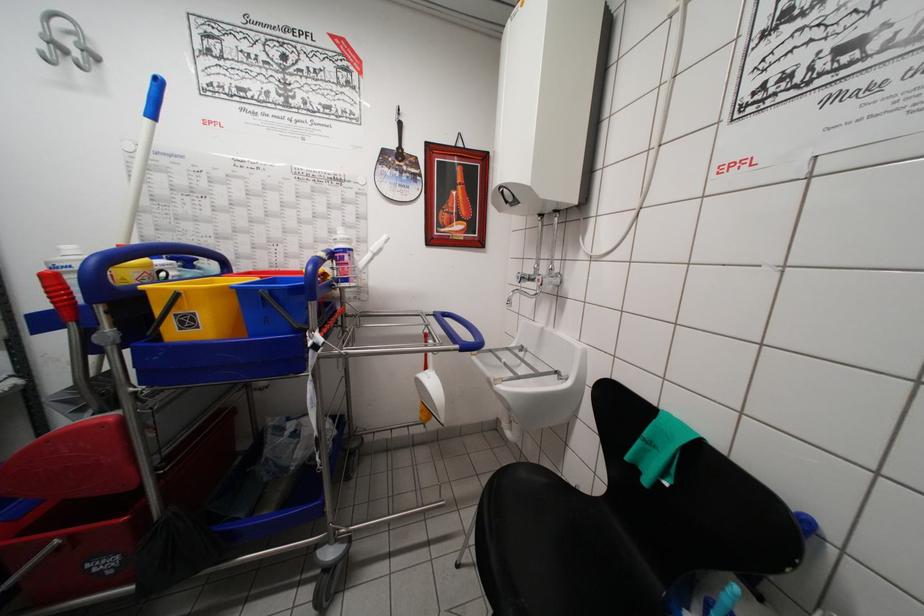
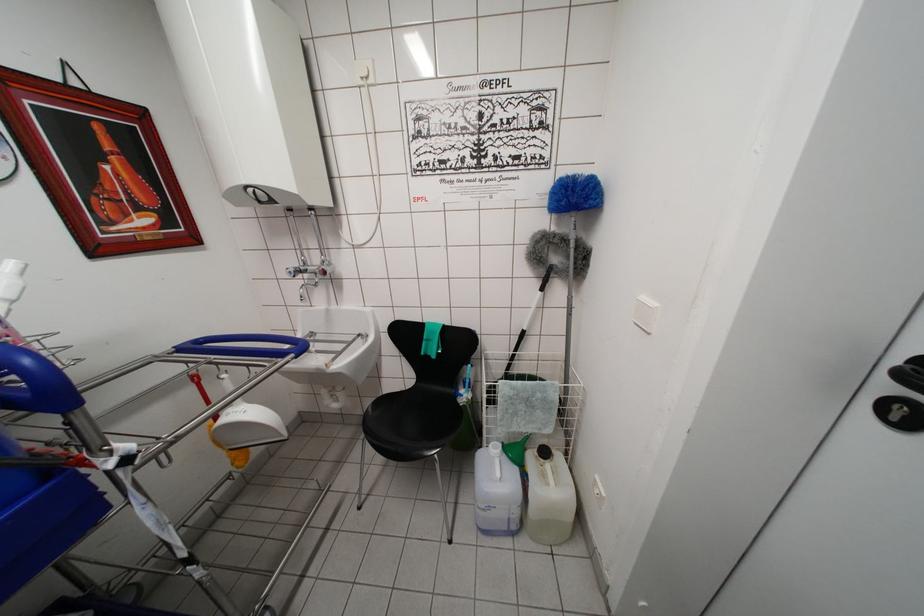
The point at (521, 282) is marked in the first image. Where is the corresponding point in the second image?

(293, 277)